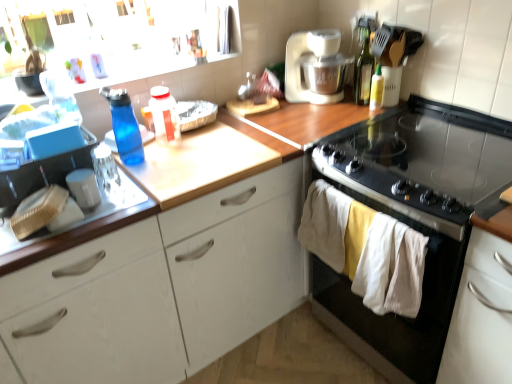
Question: In terms of width, does black glass gas stove at upper right look wider or thinner when compared to black glass stove at right?

Choices:
 (A) wide
 (B) thin

Answer: (A)

Question: Is point (390, 147) closer or farther from the camera than point (368, 340)?

Choices:
 (A) closer
 (B) farther

Answer: (A)

Question: Estimate the real-world distances between objects in this image. Which object is closer to the black glass gas stove at upper right?

Choices:
 (A) green glass bottle at upper right, the 3th bottle in the left-to-right sequence
 (B) translucent plastic bottle at center, the 3th bottle from the right
 (C) blue translucent bottle at left, the fourth bottle from the right
 (D) black glass stove at right
 (E) white wood cabinet at lower right, the 1th cabinetry when ordered from right to left

Answer: (D)

Question: Estimate the real-world distances between objects in this image. Which object is closer to the wooden at upper center?

Choices:
 (A) translucent plastic bottle at center, the 3th bottle from the right
 (B) white plastic mixer at upper right
 (C) blue translucent bottle at left, the 1th bottle in the left-to-right sequence
 (D) white wood cabinet at center, which is the second cabinetry from right to left
 (E) green glass bottle at upper right, arranged as the 2th bottle when viewed from the right

Answer: (A)